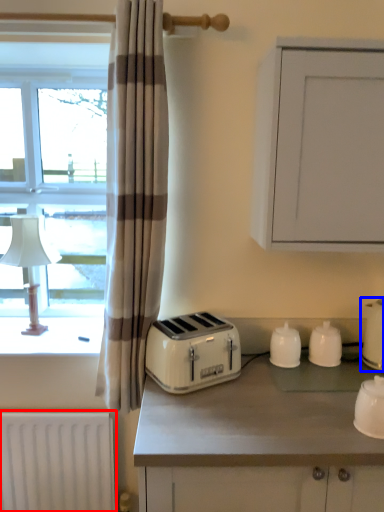
Question: Which object is closer to the camera taking this photo, radiator (highlighted by a red box) or kitchen appliance (highlighted by a blue box)?

Choices:
 (A) radiator
 (B) kitchen appliance

Answer: (B)